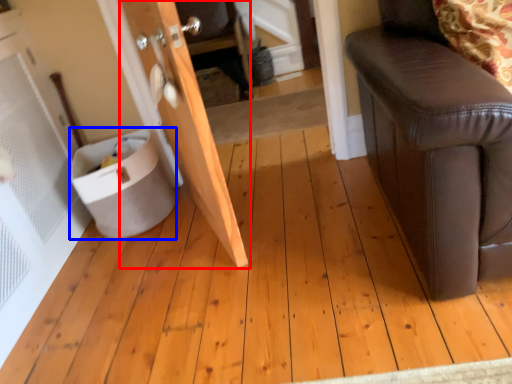
Question: Which point is closer to the camera, door (highlighted by a red box) or potty (highlighted by a blue box)?

Choices:
 (A) door
 (B) potty

Answer: (A)